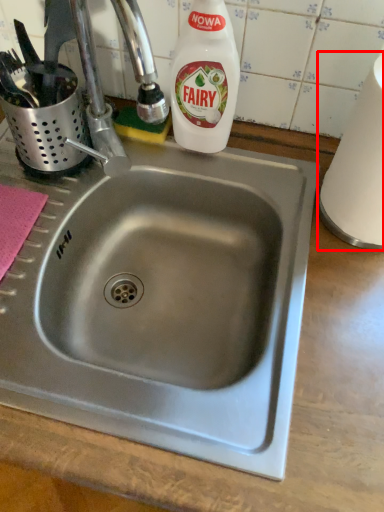
Question: From the image's perspective, what is the correct spatial relationship of paper towel (annotated by the red box) in relation to cleaning product?

Choices:
 (A) above
 (B) below

Answer: (B)